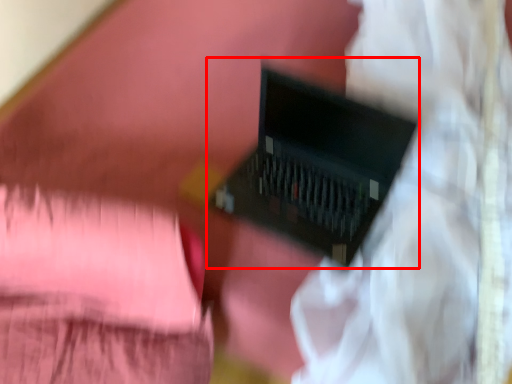
Question: From the image's perspective, where is computer (annotated by the red box) located in relation to curtain in the image?

Choices:
 (A) above
 (B) below

Answer: (B)